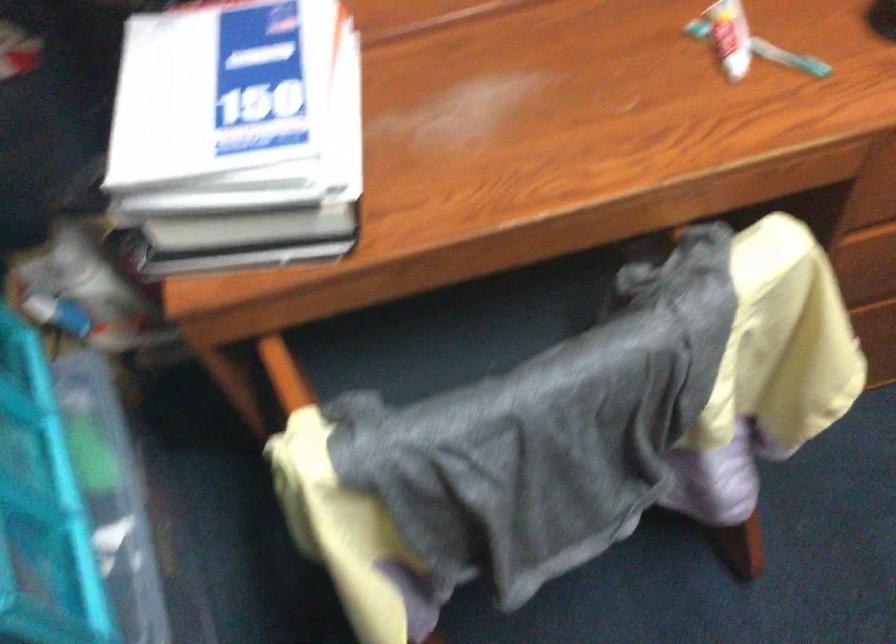
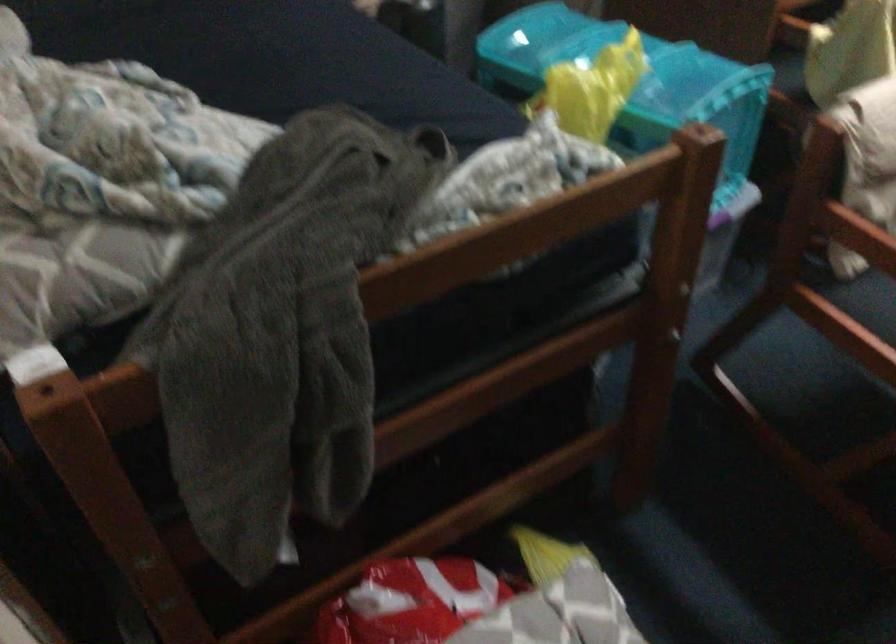
Which direction would the cameraman need to move to produce the second image?

The cameraman walked toward left, backward.